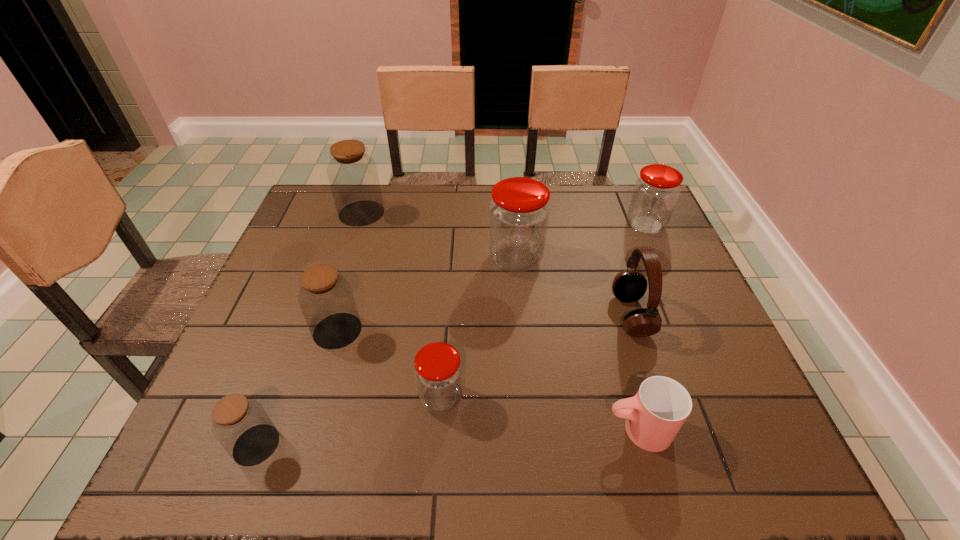
You are a GUI agent. You are given a task and a screenshot of the screen. Output one action in this format:
    pyautogui.click(x=<x>, y=<y>)
    Task: Click on the biggest brown jar
    
    Given the screenshot: What is the action you would take?
    pyautogui.click(x=353, y=176)

Locate an element on the screen. the second nearest red jar is located at coordinates (519, 212).

The height and width of the screenshot is (540, 960). What are the coordinates of `the sixth nearest object` in the screenshot? It's located at (519, 212).

This screenshot has height=540, width=960. Find the location of `headset`. headset is located at coordinates (628, 286).

This screenshot has height=540, width=960. I want to click on the rightmost jar, so click(656, 192).

Where is `the rightmost object`? The height and width of the screenshot is (540, 960). the rightmost object is located at coordinates (656, 192).

You are a GUI agent. You are given a task and a screenshot of the screen. Output one action in this format:
    pyautogui.click(x=<x>, y=<y>)
    Task: Click on the fourth farthest jar
    
    Given the screenshot: What is the action you would take?
    326,299

Find the location of a particular element. the second biggest brown jar is located at coordinates (326, 299).

This screenshot has width=960, height=540. Find the location of `the fourth jar from left to right`. the fourth jar from left to right is located at coordinates (438, 372).

The height and width of the screenshot is (540, 960). I want to click on the leftmost red jar, so click(x=438, y=372).